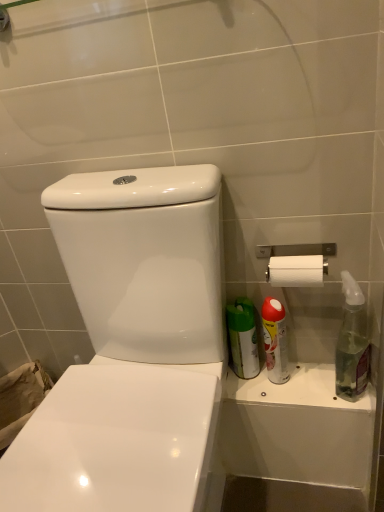
Question: From the image's perspective, is clear glass spray bottle at right, positioned as the 2th cleaning product in left-to-right order, above or below white glossy toilet at center?

Choices:
 (A) below
 (B) above

Answer: (B)

Question: Relative to white glossy toilet at center, is clear glass spray bottle at right, positioned as the 2th cleaning product in left-to-right order, in front or behind?

Choices:
 (A) front
 (B) behind

Answer: (B)

Question: Which is farther from the red matte spray can at right, positioned as the first cleaning product in left-to-right order?

Choices:
 (A) clear glass spray bottle at right, positioned as the 2th cleaning product in left-to-right order
 (B) silver metallic toilet paper holder at upper right
 (C) white glossy toilet at center

Answer: (C)

Question: Estimate the real-world distances between objects in this image. Which object is closer to the clear glass spray bottle at right, positioned as the 2th cleaning product in left-to-right order?

Choices:
 (A) silver metallic toilet paper holder at upper right
 (B) red matte spray can at right, the second cleaning product in the right-to-left sequence
 (C) white glossy toilet at center

Answer: (A)